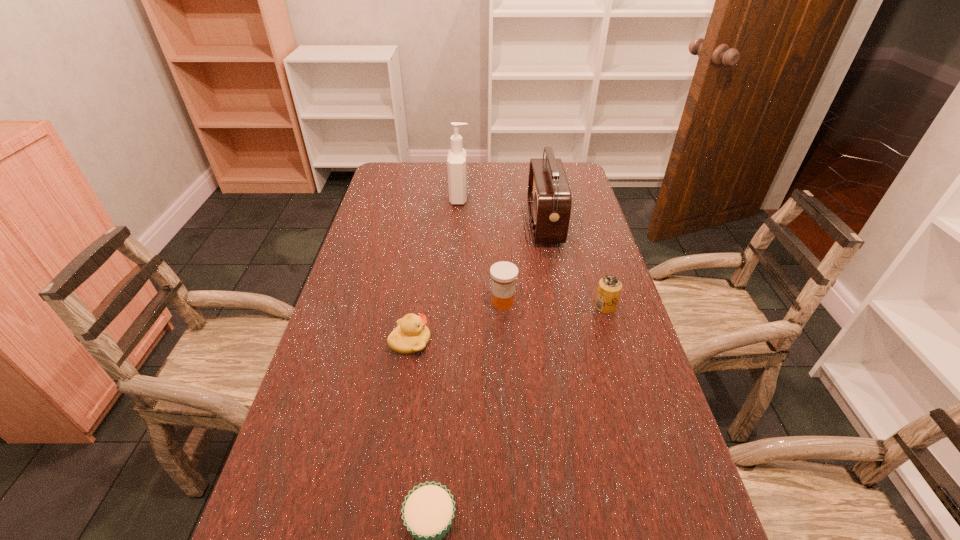
Where is `vacant space located 0.090m on the front panel of the second tallest object`? This screenshot has width=960, height=540. vacant space located 0.090m on the front panel of the second tallest object is located at coordinates (503, 224).

Identify the location of vacant space located 0.190m on the label of the medicine. This screenshot has height=540, width=960. (420, 302).

Image resolution: width=960 pixels, height=540 pixels. I want to click on free region located on the label of the medicine, so click(468, 302).

At what (x,y) coordinates should I click in order to perform the action: click on vacant position located on the label of the medicine. Please return your answer as a coordinate pair (x, y). Looking at the image, I should click on (413, 302).

Identify the location of vacant space located on the left of the rightmost object. Image resolution: width=960 pixels, height=540 pixels. [x=550, y=307].

Where is `free space located 0.250m on the beak of the duckling`? Image resolution: width=960 pixels, height=540 pixels. free space located 0.250m on the beak of the duckling is located at coordinates click(530, 342).

I want to click on object situated at the far edge, so click(x=457, y=159).

At what (x,y) coordinates should I click in order to perform the action: click on radio receiver that is at the right edge. Please return your answer as a coordinate pair (x, y). The image size is (960, 540). Looking at the image, I should click on (549, 200).

Identify the location of beer can present at the right edge. (609, 288).

The image size is (960, 540). I want to click on free space at the left edge of the desktop, so click(x=376, y=283).